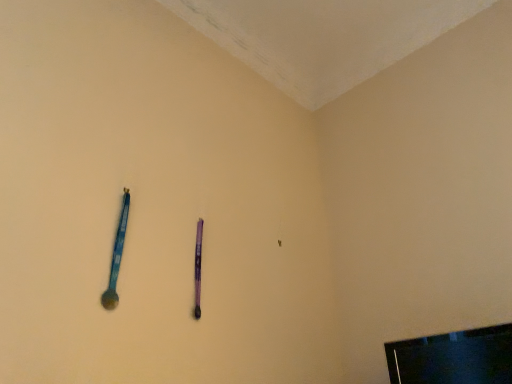
Question: From a real-world perspective, is black glossy television at lower right physically located above or below blue plastic spoon at left?

Choices:
 (A) below
 (B) above

Answer: (A)

Question: From the image's perspective, is black glossy television at lower right above or below blue plastic spoon at left?

Choices:
 (A) above
 (B) below

Answer: (B)

Question: Based on their relative distances, which object is farther from the blue plastic spoon at left?

Choices:
 (A) black glossy television at lower right
 (B) purple matte pen at center

Answer: (A)

Question: Considering the real-world distances, which object is farthest from the black glossy television at lower right?

Choices:
 (A) blue plastic spoon at left
 (B) purple matte pen at center

Answer: (A)